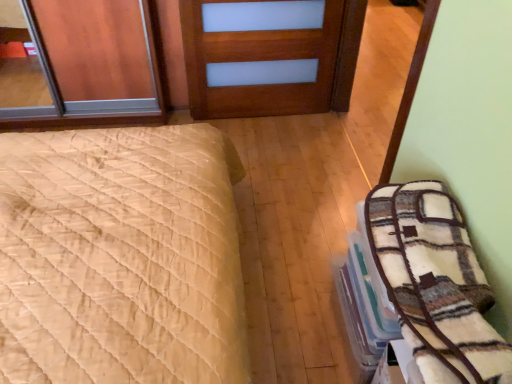
Question: Considering the relative sizes of plush white blanket at right and beige quilted bed at left in the image provided, is plush white blanket at right shorter than beige quilted bed at left?

Choices:
 (A) no
 (B) yes

Answer: (B)

Question: From a real-world perspective, is plush white blanket at right positioned over beige quilted bed at left based on gravity?

Choices:
 (A) no
 (B) yes

Answer: (B)

Question: Can you confirm if plush white blanket at right is smaller than beige quilted bed at left?

Choices:
 (A) no
 (B) yes

Answer: (B)

Question: Does plush white blanket at right have a larger size compared to beige quilted bed at left?

Choices:
 (A) yes
 (B) no

Answer: (B)

Question: Is plush white blanket at right outside beige quilted bed at left?

Choices:
 (A) yes
 (B) no

Answer: (A)

Question: Considering the positions of wooden door at center and beige quilted bed at left in the image, is wooden door at center taller or shorter than beige quilted bed at left?

Choices:
 (A) tall
 (B) short

Answer: (B)

Question: Is wooden door at center situated inside beige quilted bed at left or outside?

Choices:
 (A) outside
 (B) inside

Answer: (A)

Question: Visually, is wooden door at center positioned to the left or to the right of beige quilted bed at left?

Choices:
 (A) right
 (B) left

Answer: (A)

Question: Is wooden door at center in front of or behind beige quilted bed at left in the image?

Choices:
 (A) front
 (B) behind

Answer: (B)

Question: Based on their positions, is plush white blanket at right located to the left or right of wooden door at center?

Choices:
 (A) right
 (B) left

Answer: (A)

Question: In terms of size, does plush white blanket at right appear bigger or smaller than wooden door at center?

Choices:
 (A) big
 (B) small

Answer: (B)

Question: Considering their positions, is plush white blanket at right located in front of or behind wooden door at center?

Choices:
 (A) front
 (B) behind

Answer: (A)

Question: Considering the positions of point (479, 332) and point (260, 54), is point (479, 332) closer or farther from the camera than point (260, 54)?

Choices:
 (A) closer
 (B) farther

Answer: (A)

Question: Based on their sizes in the image, would you say plush white blanket at right is bigger or smaller than beige quilted bed at left?

Choices:
 (A) big
 (B) small

Answer: (B)

Question: Relative to beige quilted bed at left, is plush white blanket at right in front or behind?

Choices:
 (A) behind
 (B) front

Answer: (A)